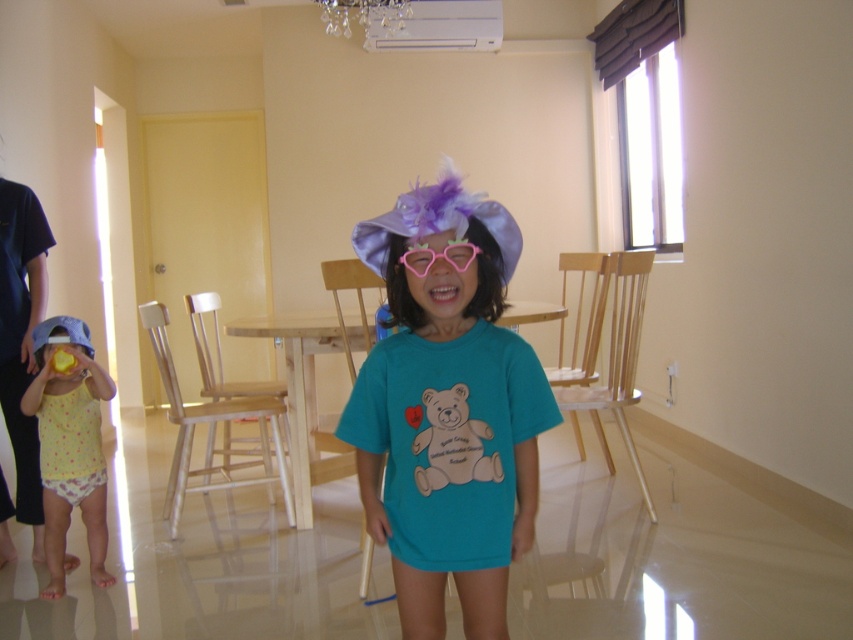
You are standing at the point with coordinates point (404, 264) and want to move to the point with coordinates point (90, 564). Is the destination point behind you or in front of you?

The destination point with coordinates point (90, 564) is behind the starting point with coordinates point (404, 264), so it is behind you.

You are a photographer adjusting your camera settings to focus on the matte purple hat at center. According to the coordinates provided, where exactly should you position your camera to ensure the hat is in the center of the frame?

The matte purple hat at center is located at point [447,412], so you should position your camera to focus precisely at those coordinates to center the hat in the frame.

You are a photographer standing in the room. You want to take a closeup photo of the matte purple hat at center. The camera you are using has a minimum focusing distance of 1.2 meters. Can you take the photo without moving closer?

The matte purple hat at center is 1.33 meters away from the camera. Since the minimum focusing distance is 1.2 meters, the photographer can take the photo without moving closer because the hat is within the camera range.